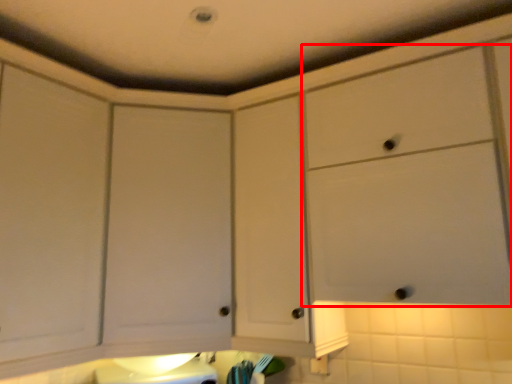
Question: From the image's perspective, where is cabinetry (annotated by the red box) located in relation to cabinetry in the image?

Choices:
 (A) above
 (B) below

Answer: (A)